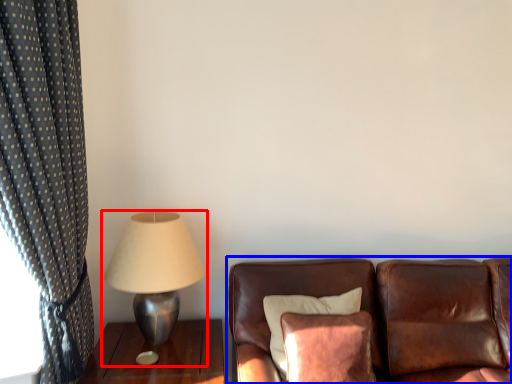
Question: Which point is closer to the camera, lamp (highlighted by a red box) or studio couch (highlighted by a blue box)?

Choices:
 (A) lamp
 (B) studio couch

Answer: (B)